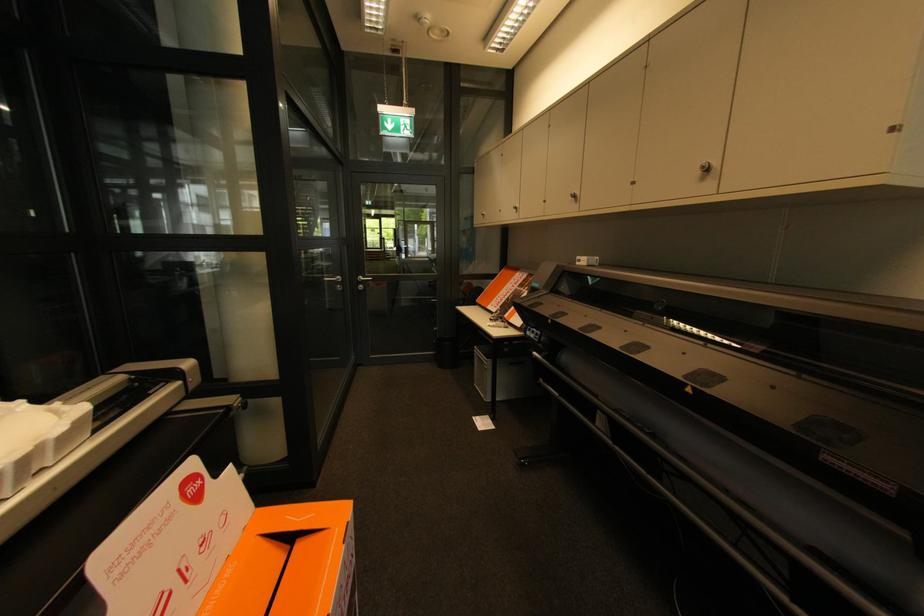
The location [289,564] corresponds to which object?

It refers to a orange cardboard box.